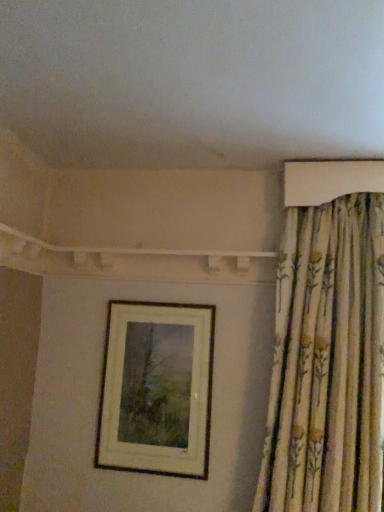
Question: Considering the positions of point [301, 394] and point [172, 343], is point [301, 394] closer or farther from the camera than point [172, 343]?

Choices:
 (A) closer
 (B) farther

Answer: (A)

Question: From a real-world perspective, is floral fabric curtain at upper right physically located above or below wooden picture frame at center?

Choices:
 (A) above
 (B) below

Answer: (A)

Question: Is floral fabric curtain at upper right inside the boundaries of wooden picture frame at center, or outside?

Choices:
 (A) outside
 (B) inside

Answer: (A)

Question: Is wooden picture frame at center inside or outside of floral fabric curtain at upper right?

Choices:
 (A) inside
 (B) outside

Answer: (B)

Question: From a real-world perspective, is wooden picture frame at center positioned above or below floral fabric curtain at upper right?

Choices:
 (A) below
 (B) above

Answer: (A)

Question: Considering the positions of wooden picture frame at center and floral fabric curtain at upper right in the image, is wooden picture frame at center wider or thinner than floral fabric curtain at upper right?

Choices:
 (A) thin
 (B) wide

Answer: (A)

Question: Is point (193, 320) closer or farther from the camera than point (349, 428)?

Choices:
 (A) closer
 (B) farther

Answer: (B)